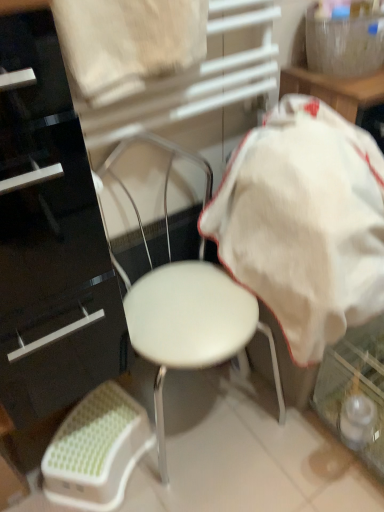
What do you see at coordinates (129, 44) in the screenshot? I see `white fabric at upper center` at bounding box center [129, 44].

Measure the distance between point (155, 144) and camera.

Point (155, 144) and camera are 1.12 meters apart.

Describe the element at coordinates (96, 450) in the screenshot. I see `white plastic bar stool at lower left` at that location.

The image size is (384, 512). I want to click on white cotton blanket at center, so click(304, 223).

From the image's perspective, between white plastic bar stool at lower left and white matte chair at center, who is located below?

From the image's view, white plastic bar stool at lower left is below.

Is white plastic bar stool at lower left to the left of white matte chair at center from the viewer's perspective?

Yes.

Which of these two, white plastic bar stool at lower left or white matte chair at center, is bigger?

white matte chair at center.

Is white plastic bar stool at lower left taller or shorter than white matte chair at center?

In the image, white plastic bar stool at lower left appears to be shorter than white matte chair at center.

From the image's perspective, is white cotton blanket at center above or below white fabric at upper center?

Clearly, from the image's perspective, white cotton blanket at center is below white fabric at upper center.

In the scene shown: Is white cotton blanket at center facing towards white fabric at upper center?

No, white cotton blanket at center is not turned towards white fabric at upper center.

In the image, is white cotton blanket at center positioned in front of or behind white fabric at upper center?

In the image, white cotton blanket at center appears behind white fabric at upper center.

The height and width of the screenshot is (512, 384). Identify the location of sheet on the left of white cotton blanket at center. (129, 44).

Could white cotton blanket at center be considered to be inside glossy black dresser at left?

No, white cotton blanket at center is not surrounded by glossy black dresser at left.

Which is closer, (x=29, y=86) or (x=289, y=315)?

The point (x=29, y=86) is more forward.

From the image's perspective, relative to white cotton blanket at center, is glossy black dresser at left above or below?

Based on their image positions, glossy black dresser at left is located beneath white cotton blanket at center.

Considering the sizes of glossy black dresser at left and white matte chair at center in the image, is glossy black dresser at left taller or shorter than white matte chair at center?

Clearly, glossy black dresser at left is taller compared to white matte chair at center.

Relative to white matte chair at center, is glossy black dresser at left in front or behind?

glossy black dresser at left is positioned closer to the viewer than white matte chair at center.

Is glossy black dresser at left at the right side of white matte chair at center?

Incorrect, glossy black dresser at left is not on the right side of white matte chair at center.

From a real-world perspective, which is physically above, glossy black dresser at left or white matte chair at center?

In real-world perspective, glossy black dresser at left is above.

In the scene shown: From the image's perspective, is glossy black dresser at left positioned above or below white plastic bar stool at lower left?

Clearly, from the image's perspective, glossy black dresser at left is above white plastic bar stool at lower left.

From a real-world perspective, is glossy black dresser at left positioned above or below white plastic bar stool at lower left?

From a real-world perspective, glossy black dresser at left is physically above white plastic bar stool at lower left.

Considering the relative sizes of glossy black dresser at left and white plastic bar stool at lower left in the image provided, is glossy black dresser at left wider than white plastic bar stool at lower left?

Indeed, glossy black dresser at left has a greater width compared to white plastic bar stool at lower left.

Is glossy black dresser at left oriented away from white plastic bar stool at lower left?

glossy black dresser at left is not turned away from white plastic bar stool at lower left.

This screenshot has height=512, width=384. I want to click on sheet above the glossy black dresser at left (from the image's perspective), so click(x=129, y=44).

Considering the sizes of glossy black dresser at left and white fabric at upper center in the image, is glossy black dresser at left taller or shorter than white fabric at upper center?

Considering their sizes, glossy black dresser at left has more height than white fabric at upper center.

Between glossy black dresser at left and white fabric at upper center, which one appears on the left side from the viewer's perspective?

glossy black dresser at left is more to the left.

Is the surface of glossy black dresser at left in direct contact with white fabric at upper center?

No, glossy black dresser at left is not with white fabric at upper center.

Considering the relative positions of white fabric at upper center and glossy black dresser at left in the image provided, is white fabric at upper center to the left of glossy black dresser at left from the viewer's perspective?

Incorrect, white fabric at upper center is not on the left side of glossy black dresser at left.

The height and width of the screenshot is (512, 384). I want to click on dresser in front of the white fabric at upper center, so click(50, 241).

From the picture: Which is farther from the camera, (128, 69) or (69, 309)?

The point (69, 309) is farther from the camera.

Identify the location of chair lying on the right of white plastic bar stool at lower left. (185, 304).

The width and height of the screenshot is (384, 512). I want to click on blanket below the white fabric at upper center (from a real-world perspective), so click(x=304, y=223).

Based on their spatial positions, is glossy black dresser at left or white fabric at upper center closer to white cotton blanket at center?

The object closer to white cotton blanket at center is white fabric at upper center.

From the picture: From the image, which object appears to be nearer to white matte chair at center, white plastic bar stool at lower left or white cotton blanket at center?

white cotton blanket at center.

Looking at the image, which one is located further to white matte chair at center, white plastic bar stool at lower left or glossy black dresser at left?

Based on the image, white plastic bar stool at lower left appears to be further to white matte chair at center.

When comparing their distances from white cotton blanket at center, does white plastic bar stool at lower left or white fabric at upper center seem further?

white plastic bar stool at lower left lies further to white cotton blanket at center than the other object.

From the image, which object appears to be nearer to white fabric at upper center, white matte chair at center or white plastic bar stool at lower left?

The object closer to white fabric at upper center is white matte chair at center.

Looking at the image, which one is located closer to white plastic bar stool at lower left, white matte chair at center or glossy black dresser at left?

Based on the image, glossy black dresser at left appears to be nearer to white plastic bar stool at lower left.

Estimate the real-world distances between objects in this image. Which object is closer to white plastic bar stool at lower left, white matte chair at center or white cotton blanket at center?

The object closer to white plastic bar stool at lower left is white matte chair at center.

Considering their positions, is white cotton blanket at center positioned further to white plastic bar stool at lower left than glossy black dresser at left?

The object further to white plastic bar stool at lower left is white cotton blanket at center.

The height and width of the screenshot is (512, 384). In order to click on chair between white cotton blanket at center and white plastic bar stool at lower left vertically in this screenshot , I will do `click(185, 304)`.

This screenshot has width=384, height=512. Identify the location of dresser between white fabric at upper center and white matte chair at center vertically. (50, 241).

Locate an element on the screen. This screenshot has height=512, width=384. blanket between white fabric at upper center and white plastic bar stool at lower left in the up-down direction is located at coordinates (304, 223).

What are the coordinates of `bar stool between glossy black dresser at left and white cotton blanket at center from left to right` in the screenshot? It's located at (96, 450).